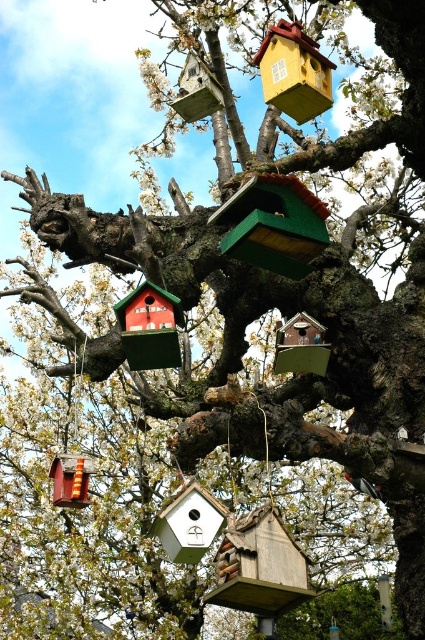
You are a bird looking for a place to land. You see the matte green wooden bird feeder at center and the wooden bird feeder at lower left. Which feeder has a larger surface area to stand on?

The matte green wooden bird feeder at center might be wider than wooden bird feeder at lower left, so it likely has a larger surface area to stand on.

From the picture: You are standing in front of the tree with the birdhouses. You notice the matte green wooden bird feeder at center and the wooden bird feeder at lower left. Which one do you think is closer to you?

The matte green wooden bird feeder at center is closer to the viewer than the wooden bird feeder at lower left.